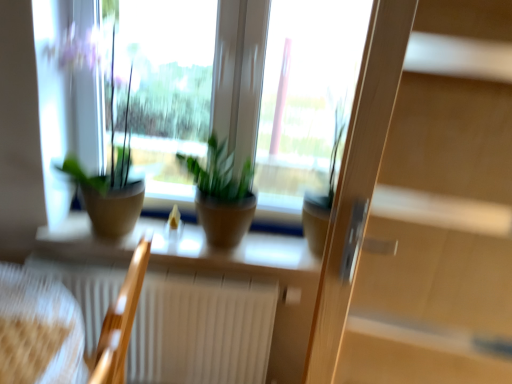
Question: Which is correct: green matte plant at center, the 2th houseplant when ordered from left to right, is inside matte brown pot at center, or outside of it?

Choices:
 (A) outside
 (B) inside

Answer: (A)

Question: Is green matte plant at center, marked as the second houseplant in a right-to-left arrangement, wider or thinner than matte brown pot at center?

Choices:
 (A) wide
 (B) thin

Answer: (A)

Question: Which is farther from the green matte plant at center, the 2th houseplant when ordered from left to right?

Choices:
 (A) green matte plant pot at left, the third houseplant when ordered from right to left
 (B) wooden armchair at lower left, the first armchair viewed from the left
 (C) green matte plant at center, the first houseplant from the right
 (D) white textured radiator at lower center
 (E) wooden screen door at right

Answer: (B)

Question: Considering the real-world distances, which object is farthest from the green matte plant at center, the first houseplant from the right?

Choices:
 (A) white textured radiator at lower center
 (B) matte brown pot at center
 (C) wooden armchair at lower left, the 2th armchair positioned from the right
 (D) wooden screen door at right
 (E) wooden armchair at lower left, the 2th armchair in the left-to-right sequence

Answer: (C)